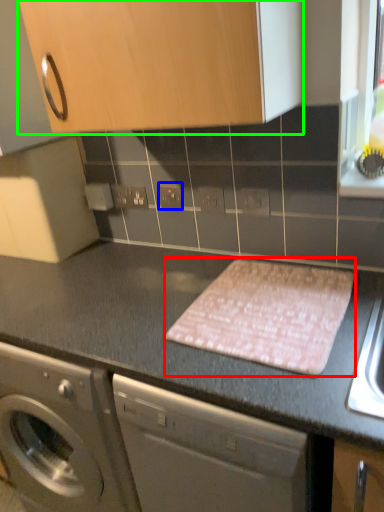
Question: Based on their relative distances, which object is farther from blanket (highlighted by a red box)? Choose from electric outlet (highlighted by a blue box) and cabinetry (highlighted by a green box).

Choices:
 (A) electric outlet
 (B) cabinetry

Answer: (A)